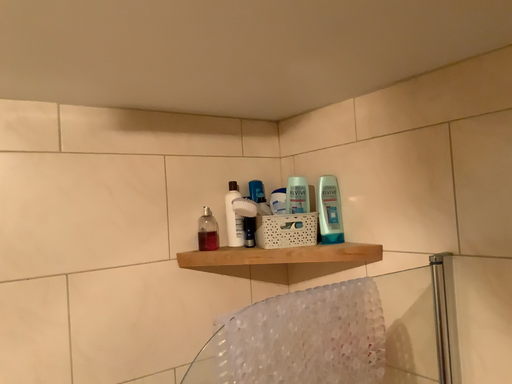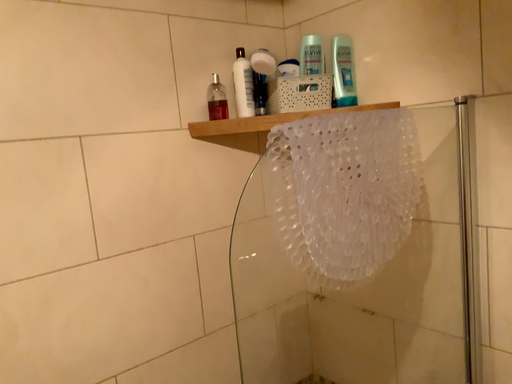
Question: How did the camera likely rotate when shooting the video?

Choices:
 (A) rotated downward
 (B) rotated upward

Answer: (A)